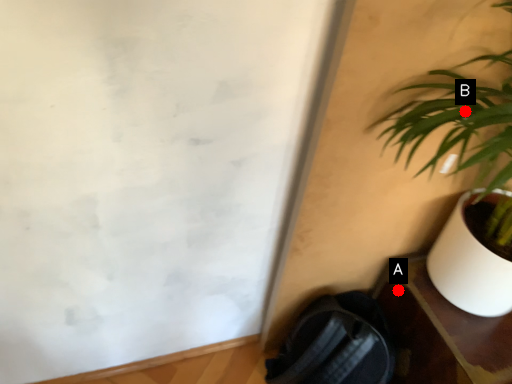
Question: Two points are circled on the image, labeled by A and B beside each circle. Among these points, which one is nearest to the camera?

Choices:
 (A) A is closer
 (B) B is closer

Answer: (B)